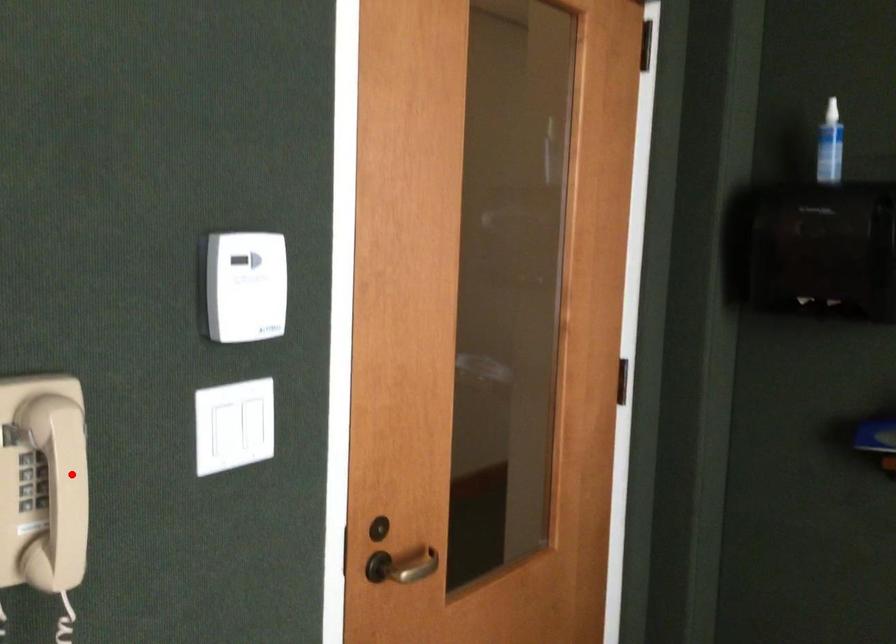
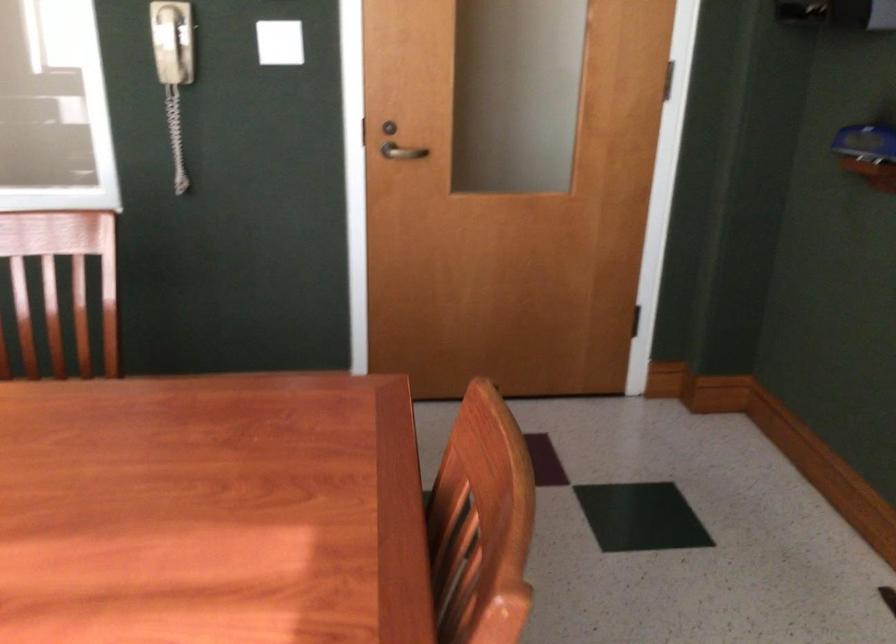
Locate, in the second image, the point that corresponds to the highlighted location in the first image.

(171, 41)